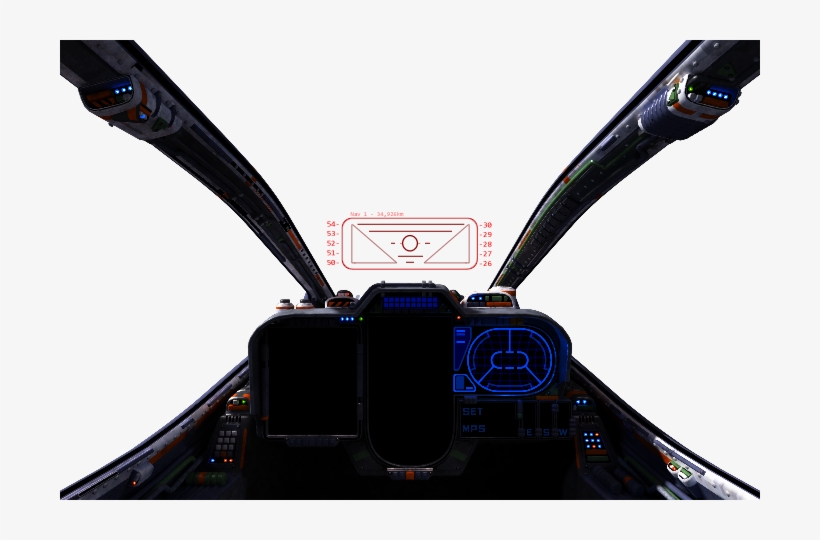
The height and width of the screenshot is (540, 820). I want to click on keypad, so click(225, 441), click(593, 444).